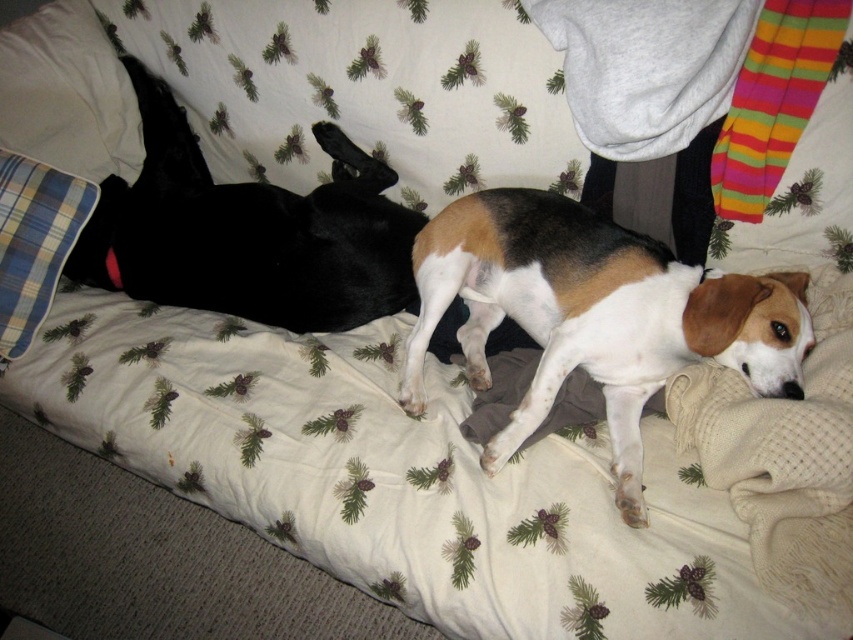
What do you see at coordinates (595, 316) in the screenshot?
I see `tri-colored fur dog at center` at bounding box center [595, 316].

Which is more to the left, tri-colored fur dog at center or blue plaid pillow at left?

blue plaid pillow at left

Locate an element on the screen. tri-colored fur dog at center is located at coordinates (595, 316).

Between black smooth dog at left and plaid fabric pillow at left, which one appears on the right side from the viewer's perspective?

black smooth dog at left is more to the right.

Can you confirm if black smooth dog at left is wider than plaid fabric pillow at left?

Yes.

What are the coordinates of `black smooth dog at left` in the screenshot? It's located at (248, 232).

Where is `black smooth dog at left`? The height and width of the screenshot is (640, 853). black smooth dog at left is located at coordinates (248, 232).

Is tri-colored fur dog at center shorter than black smooth dog at left?

Yes, tri-colored fur dog at center is shorter than black smooth dog at left.

Which is above, tri-colored fur dog at center or black smooth dog at left?

black smooth dog at left is higher up.

Is point (584, 310) in front of point (352, 177)?

Yes, it is in front of point (352, 177).

Identify the location of tri-colored fur dog at center. This screenshot has width=853, height=640. (595, 316).